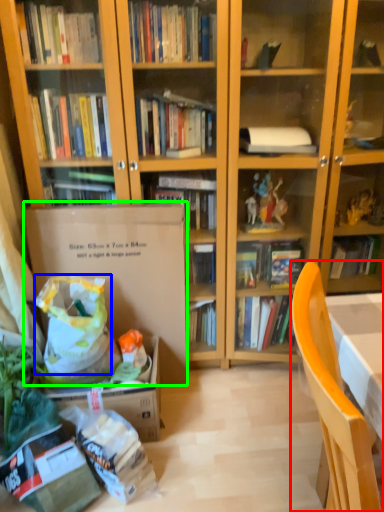
Question: Which object is positioned farthest from chair (highlighted by a red box)? Select from grocery bag (highlighted by a blue box) and paperback book (highlighted by a green box).

Choices:
 (A) grocery bag
 (B) paperback book

Answer: (B)